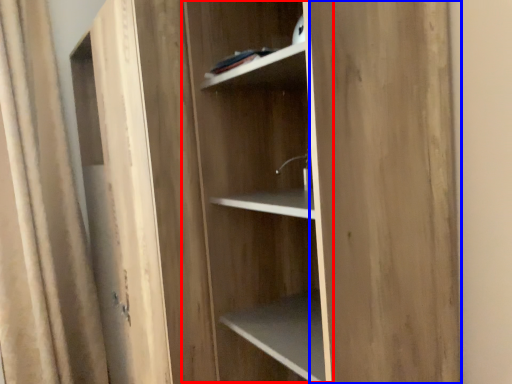
Question: Which point is further to the camera, cabinetry (highlighted by a red box) or plywood (highlighted by a blue box)?

Choices:
 (A) cabinetry
 (B) plywood

Answer: (A)